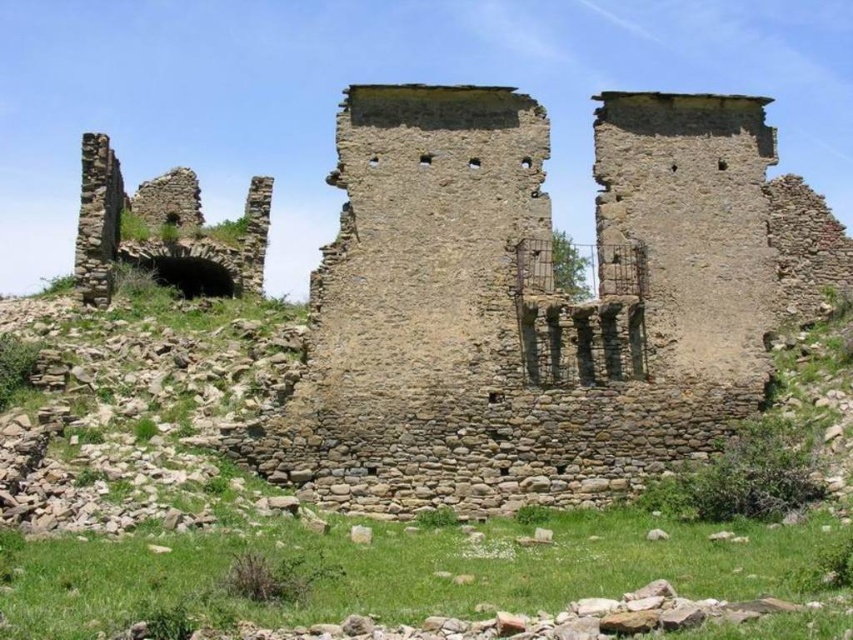
Does rustic stone castle at center have a larger size compared to rustic stone arch at left?

Yes, rustic stone castle at center is bigger than rustic stone arch at left.

Which of these two, rustic stone castle at center or rustic stone arch at left, stands shorter?

rustic stone arch at left is shorter.

Is point (640, 296) positioned behind point (119, 177)?

No.

This screenshot has height=640, width=853. What are the coordinates of `rustic stone castle at center` in the screenshot? It's located at (538, 301).